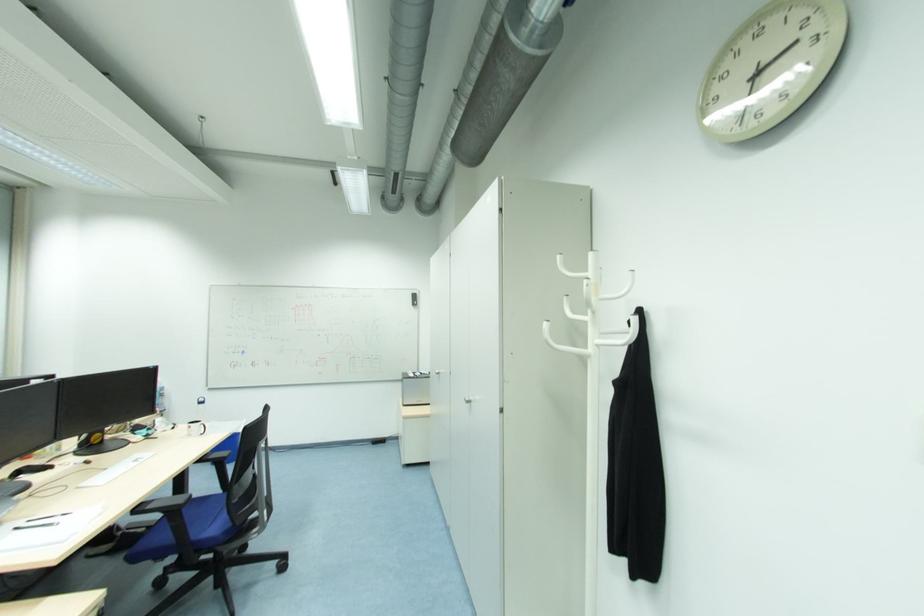
Locate an element on the screen. chair back top rail is located at coordinates (249, 445).